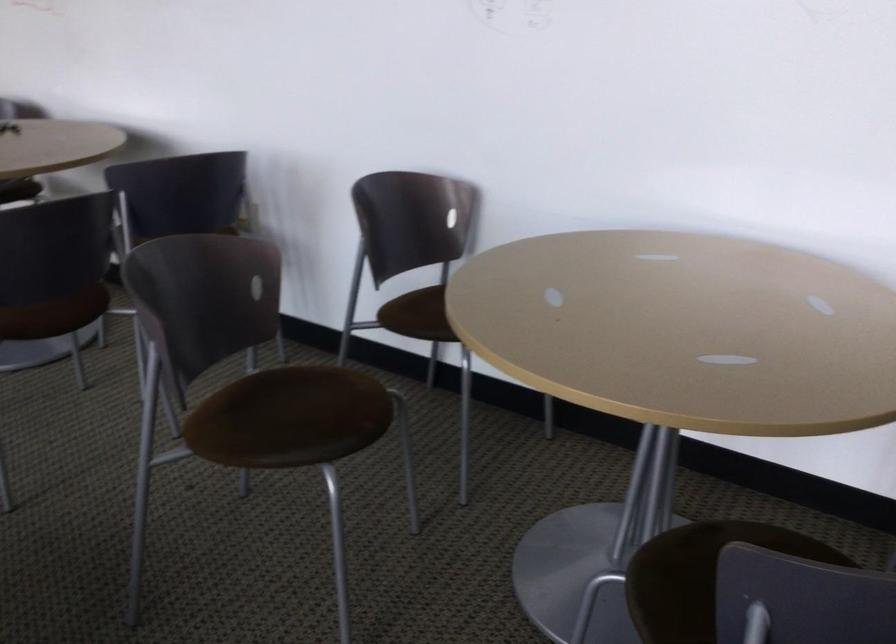
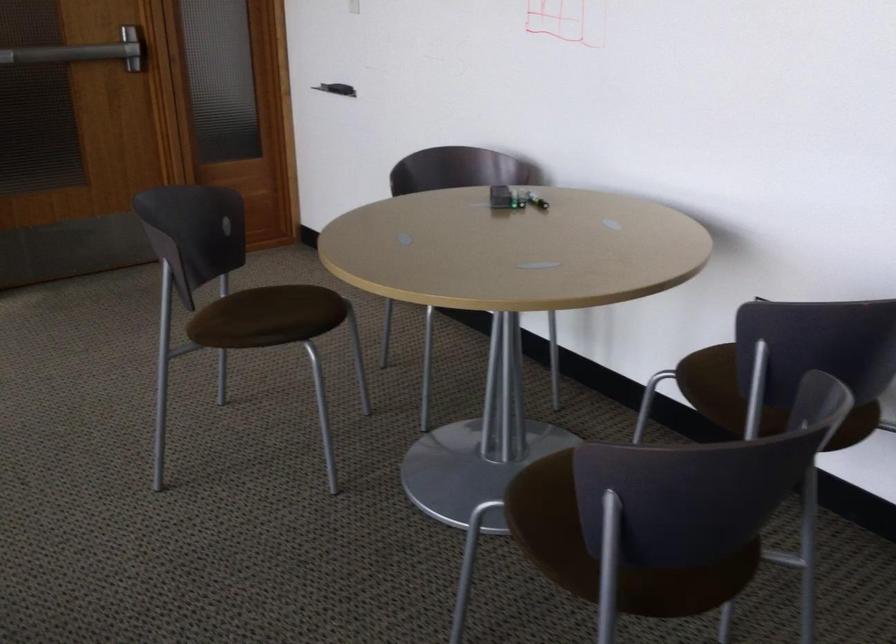
In the second image, find the point that corresponds to point 160,223 in the first image.

(745, 386)